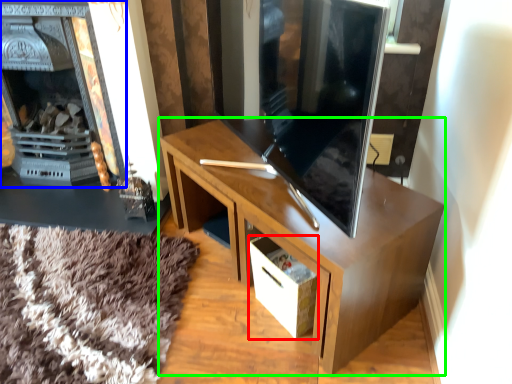
Question: Considering the real-world distances, which object is closest to drawer (highlighted by a red box)? fireplace (highlighted by a blue box) or desk (highlighted by a green box).

Choices:
 (A) fireplace
 (B) desk

Answer: (B)